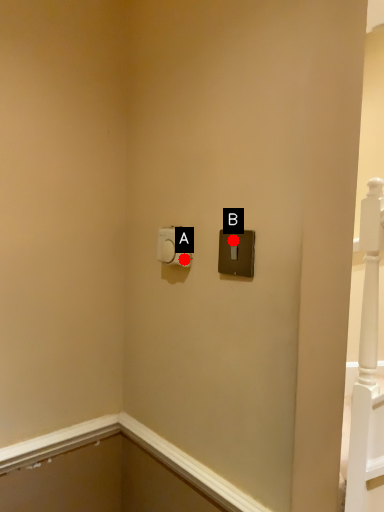
Question: Two points are circled on the image, labeled by A and B beside each circle. Which point is farther from the camera taking this photo?

Choices:
 (A) A is further
 (B) B is further

Answer: (A)